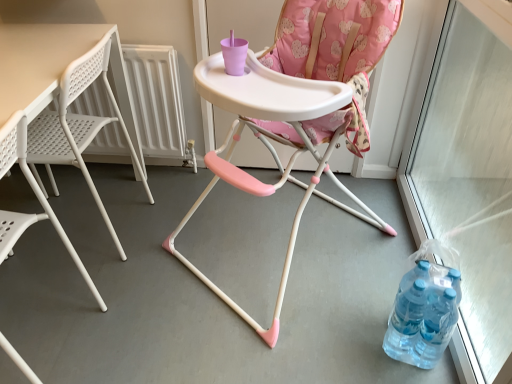
Where is `vacant space to the right of white plastic chair at left, which appears as the first chair when viewed from the left`? vacant space to the right of white plastic chair at left, which appears as the first chair when viewed from the left is located at coordinates (152, 328).